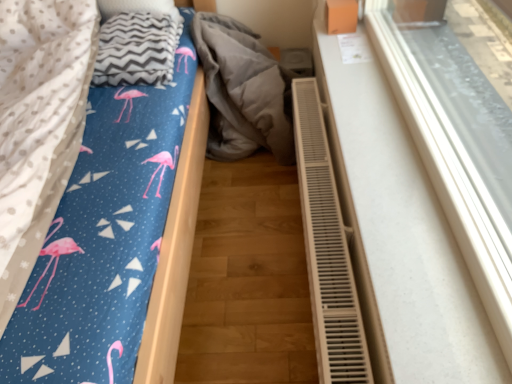
This screenshot has height=384, width=512. Identify the location of vacant space in white plastic radiator at right (from a real-world perspective). (393, 138).